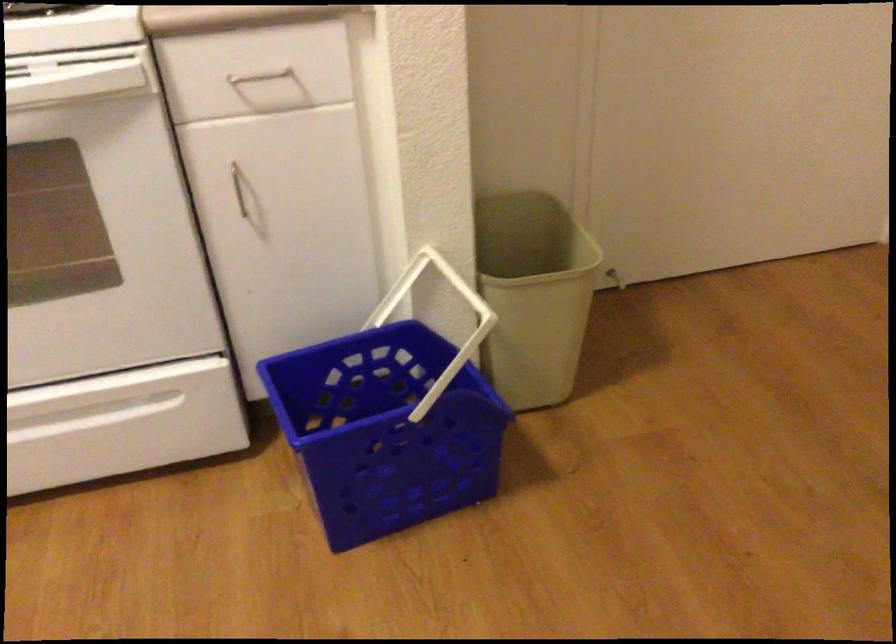
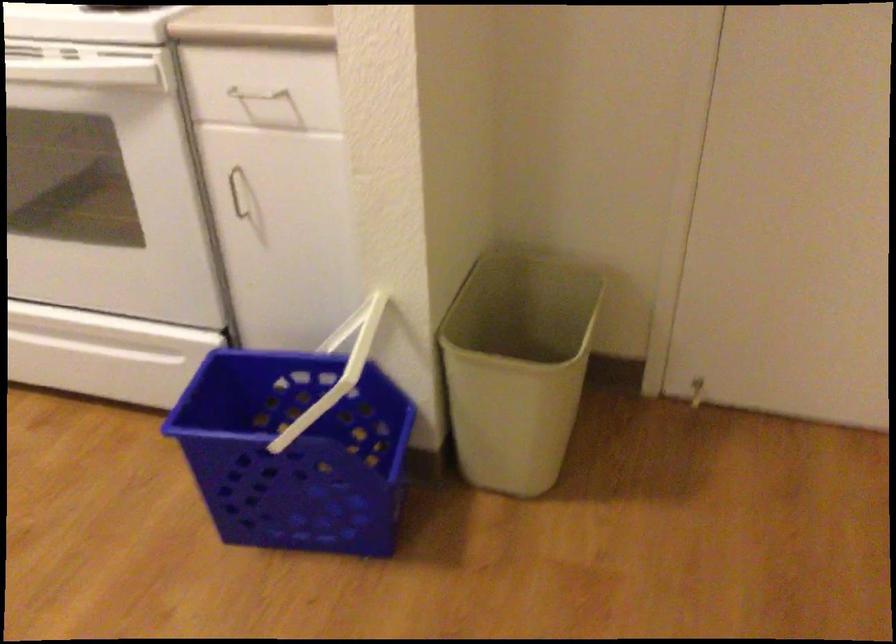
Question: The camera is either moving clockwise (left) or counter-clockwise (right) around the object. The first image is from the beginning of the video and the second image is from the end. Is the camera moving left or right when shooting the video?

Choices:
 (A) Left
 (B) Right

Answer: (B)